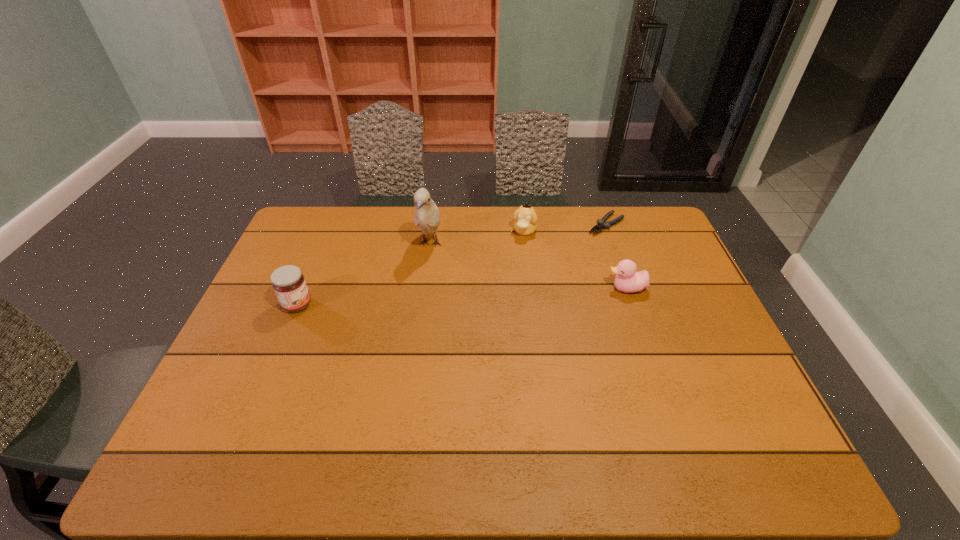
The image size is (960, 540). I want to click on vacant space on the desktop that is between the jam and the nearer duckling and is positioned on the face of the farther duckling, so click(499, 295).

Find the location of a particular element. This screenshot has width=960, height=540. free spot on the desktop that is between the leftmost object and the nearer duckling and is positioned at the beak of the bird is located at coordinates (416, 299).

The height and width of the screenshot is (540, 960). Find the location of `vacant space on the desktop that is between the jam and the second shortest object and is positioned at the gripping part of the pliers`. vacant space on the desktop that is between the jam and the second shortest object and is positioned at the gripping part of the pliers is located at coordinates (511, 294).